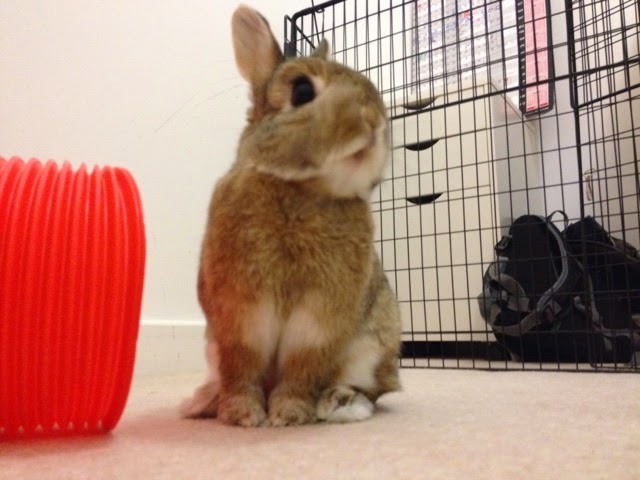
Identify the location of floor. The width and height of the screenshot is (640, 480). (436, 435).